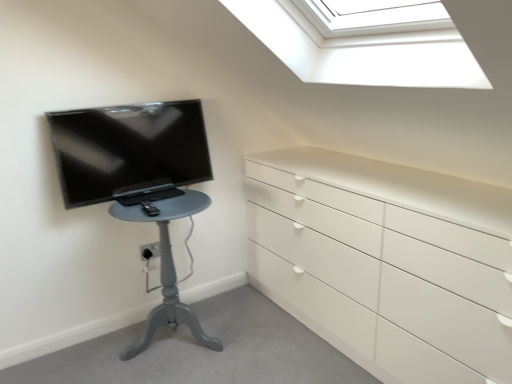
Image resolution: width=512 pixels, height=384 pixels. In order to click on blank space to the left of matte gray table at left in this screenshot , I will do `click(76, 355)`.